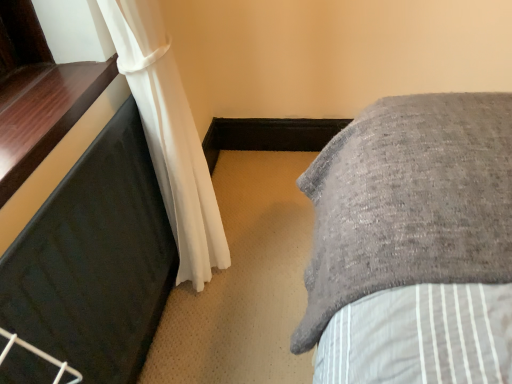
Locate an element on the screen. Image resolution: width=512 pixels, height=384 pixels. free space to the right of black rubber mat at left is located at coordinates (260, 295).